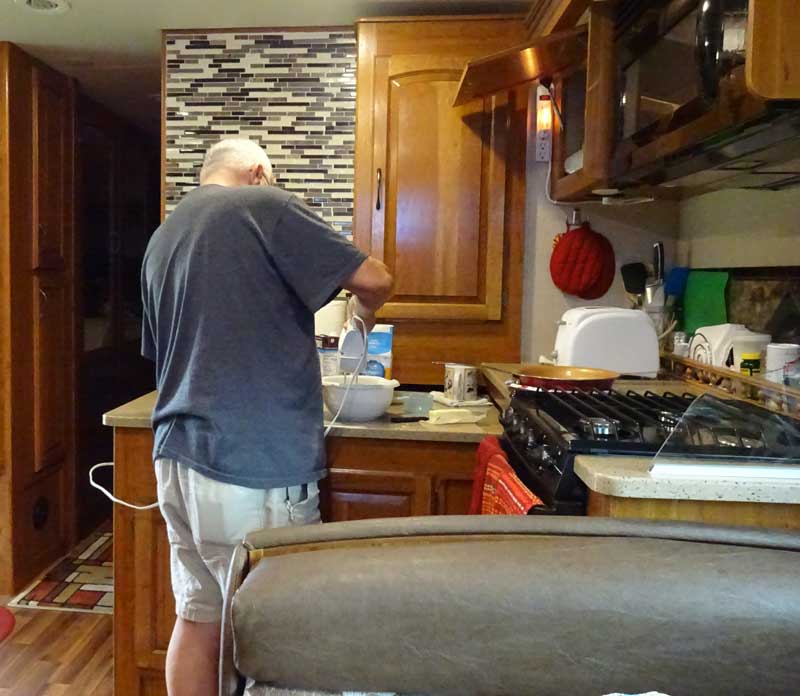
Image resolution: width=800 pixels, height=696 pixels. Identify the location of door handle. (378, 198).